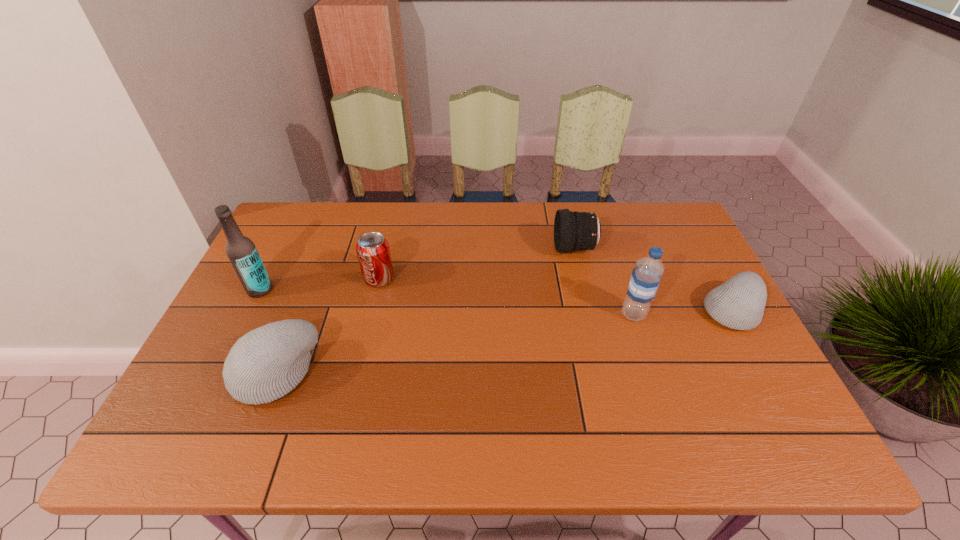
Locate an element on the screen. This screenshot has width=960, height=540. object that is at the far edge is located at coordinates (574, 231).

Image resolution: width=960 pixels, height=540 pixels. Identify the location of object present at the near edge. (265, 364).

Locate an element on the screen. The height and width of the screenshot is (540, 960). beanie that is positioned at the left edge is located at coordinates (265, 364).

Identify the location of beer bottle located at the left edge. (241, 251).

The image size is (960, 540). Identify the location of object present at the right edge. (739, 303).

Locate an element on the screen. The width and height of the screenshot is (960, 540). object at the near left corner is located at coordinates (265, 364).

Locate an element on the screen. The image size is (960, 540). vacant area at the far edge is located at coordinates (519, 238).

Where is `vacant space at the near edge of the desktop`? The width and height of the screenshot is (960, 540). vacant space at the near edge of the desktop is located at coordinates (508, 384).

The width and height of the screenshot is (960, 540). I want to click on vacant space at the left edge of the desktop, so click(x=294, y=264).

You are a GUI agent. You are given a task and a screenshot of the screen. Output one action in this format:
    pyautogui.click(x=<x>, y=<y>)
    Task: Click on the vacant space at the right edge of the desktop
    
    Given the screenshot: What is the action you would take?
    pyautogui.click(x=699, y=371)